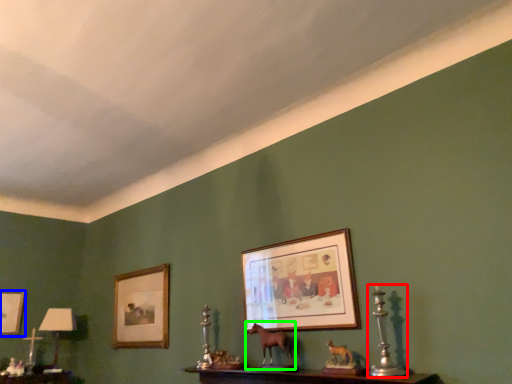
Question: Estimate the real-world distances between objects in this image. Which object is farther from candle holder (highlighted by a red box), picture frame (highlighted by a blue box) or animal (highlighted by a green box)?

Choices:
 (A) picture frame
 (B) animal

Answer: (A)